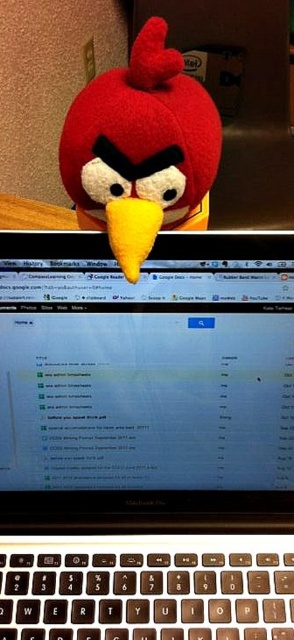
You are organizing your desk and have both the black plastic laptop at upper center and the matte plush bird at center. Which object takes up more vertical space?

The black plastic laptop at upper center is much taller than the matte plush bird at center, so it takes up more vertical space.

You are organizing your desk and want to place both the black plastic laptop at upper center and the matte plush bird at center. Which object requires more horizontal space on the desk?

The black plastic laptop at upper center requires more horizontal space on the desk because its width is larger than the matte plush bird at center.

You are looking at the computer screen in the middle section of the image. There are two points marked on the screen, one at coordinates point (144, 385) and the other at point (171, 58). Which of these points is closer to you?

Point (144, 385) is further to the camera than point (171, 58), so the point closer to you is point (171, 58).